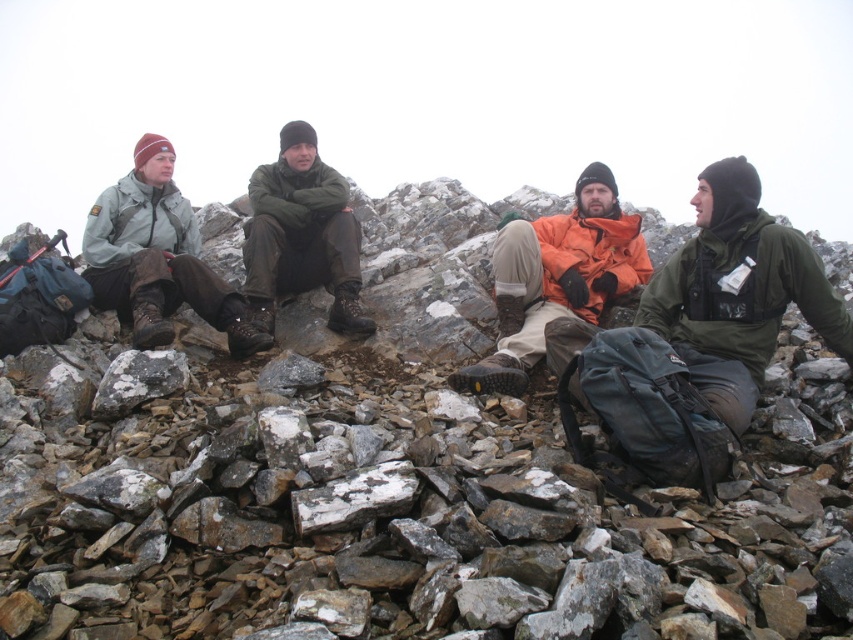
You are planning to place a small flag on the highest point of the rocky terrain at center and the white speckled rock at center. According to the image, which location would allow the flag to be seen from a lower elevation?

The flag placed on the rocky terrain at center would be visible from a lower elevation because it is positioned above the white speckled rock at center.

You are hiking on a rocky path and want to place your backpack between the rocky terrain at center and the white speckled rock at center. According to the scene description, which object should you place it next to to ensure it stays to the left?

You should place your backpack next to the white speckled rock at center because the rocky terrain at center is to the right of it, so placing the backpack next to the white speckled rock at center ensures it stays to the left.